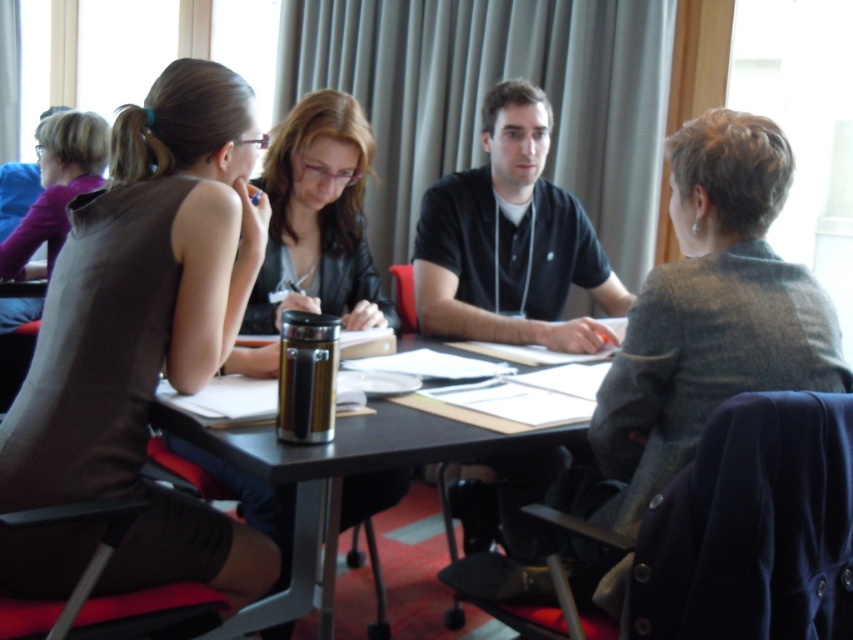
Question: Does brown fabric dress at upper left have a larger size compared to matte brown shirt at upper left?

Choices:
 (A) yes
 (B) no

Answer: (A)

Question: Which point is farther from the camera taking this photo?

Choices:
 (A) (431, 342)
 (B) (80, 132)
 (C) (184, 115)

Answer: (B)

Question: Which of the following is the farthest from the observer?

Choices:
 (A) (322, 449)
 (B) (523, 145)
 (C) (80, 179)

Answer: (C)

Question: Which object is the farthest from the black cotton shirt at center?

Choices:
 (A) metallic silver thermos at center
 (B) brown fabric dress at upper left
 (C) matte brown shirt at upper left

Answer: (C)

Question: Does brown fabric dress at upper left lie in front of metallic silver thermos at center?

Choices:
 (A) no
 (B) yes

Answer: (A)

Question: Is brown fabric dress at upper left below black cotton shirt at center?

Choices:
 (A) yes
 (B) no

Answer: (A)